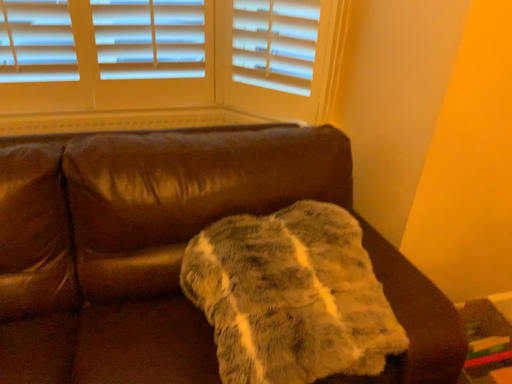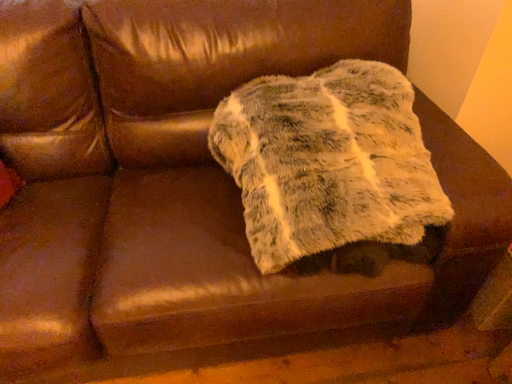
Question: How did the camera likely rotate when shooting the video?

Choices:
 (A) rotated downward
 (B) rotated upward

Answer: (A)